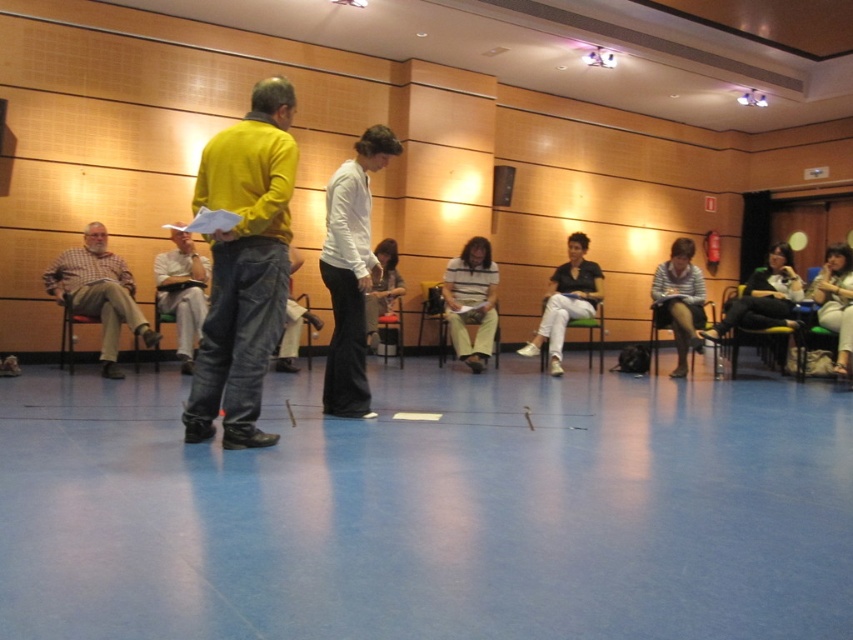
Who is higher up, brown fabric chair at left or wooden chair at center?

Positioned higher is wooden chair at center.

Is brown fabric chair at left positioned behind wooden chair at center?

No, it is in front of wooden chair at center.

Is point (111, 326) less distant than point (289, 278)?

No.

Where is `brown fabric chair at left`? The image size is (853, 640). brown fabric chair at left is located at coordinates (105, 316).

Does checkered fabric shirt at left appear on the right side of wooden chair at right?

No, checkered fabric shirt at left is not to the right of wooden chair at right.

Which is behind, point (115, 369) or point (682, 376)?

Positioned behind is point (682, 376).

Locate an element on the screen. checkered fabric shirt at left is located at coordinates (99, 292).

You are a GUI agent. You are given a task and a screenshot of the screen. Output one action in this format:
    pyautogui.click(x=<x>, y=<y>)
    Task: Click on the white cotton pants at center
    The width and height of the screenshot is (853, 640).
    Given the screenshot: What is the action you would take?
    pyautogui.click(x=566, y=301)

This screenshot has width=853, height=640. What do you see at coordinates (566, 301) in the screenshot? I see `white cotton pants at center` at bounding box center [566, 301].

Looking at this image, who is more distant from viewer, (554, 300) or (386, 308)?

The point (386, 308) is more distant.

Where is `white cotton pants at center`? white cotton pants at center is located at coordinates (566, 301).